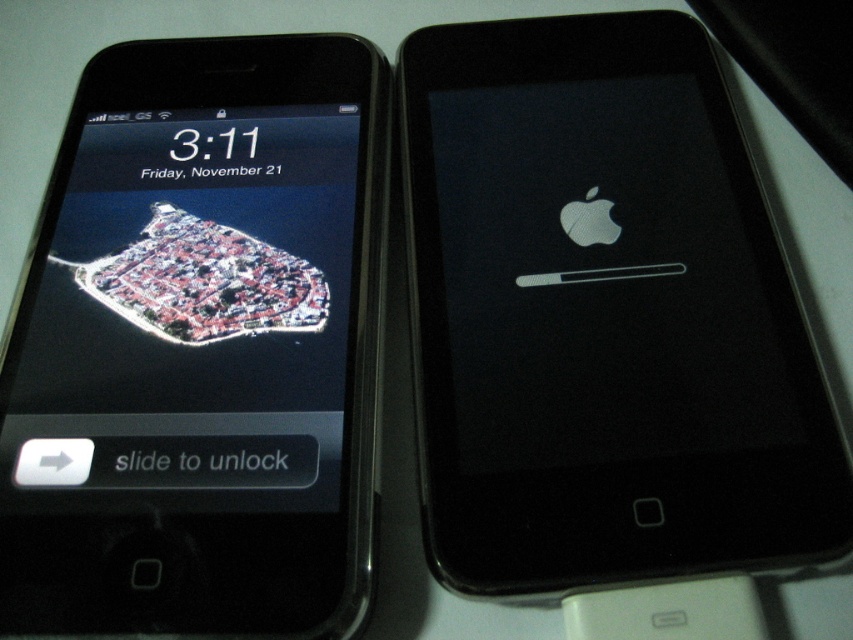
You are taking a photo of two electronic devices. The first device has a point at coordinates point (664, 209) and the second device has a point at coordinates point (18, 308). Which point will appear larger in your photo?

Point (664, 209) is further to the camera than point (18, 308), so it will appear larger in the photo.

You are trying to unlock both devices. Since the black glossy smartphone at left is behind the black matte iphone at right, which device is physically closer to you?

The black matte iphone at right is physically closer to you because the black glossy smartphone at left is behind it.

You are trying to place both the black matte iphone at right and the black glossy smartphone at left into a protective case that can only accommodate the wider of the two devices. Based on the scene description, which device should you choose to fit into the case?

The black matte iphone at right is wider than the black glossy smartphone at left, so you should choose the black matte iphone at right to fit into the case.